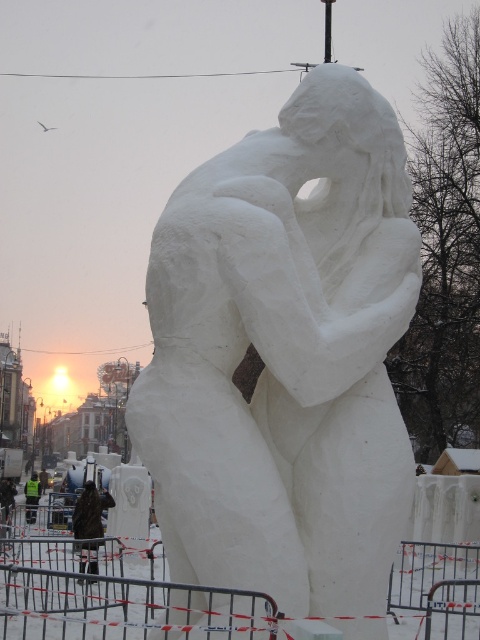
Question: Which point is farther to the camera?

Choices:
 (A) (197, 289)
 (B) (83, 525)

Answer: (B)

Question: Where is brown fabric jacket at lower left located in relation to green reflective vest at center in the image?

Choices:
 (A) left
 (B) right

Answer: (B)

Question: Observing the image, what is the correct spatial positioning of brown fabric jacket at lower left in reference to green reflective vest at center?

Choices:
 (A) left
 (B) right

Answer: (B)

Question: In this image, where is white snow sculpture at center located relative to green reflective vest at center?

Choices:
 (A) above
 (B) below

Answer: (A)

Question: Which point appears closest to the camera in this image?

Choices:
 (A) (90, 499)
 (B) (171, 472)
 (C) (26, 497)

Answer: (B)

Question: Which of these objects is positioned closest to the white snow sculpture at center?

Choices:
 (A) brown fabric jacket at lower left
 (B) green reflective vest at center

Answer: (A)